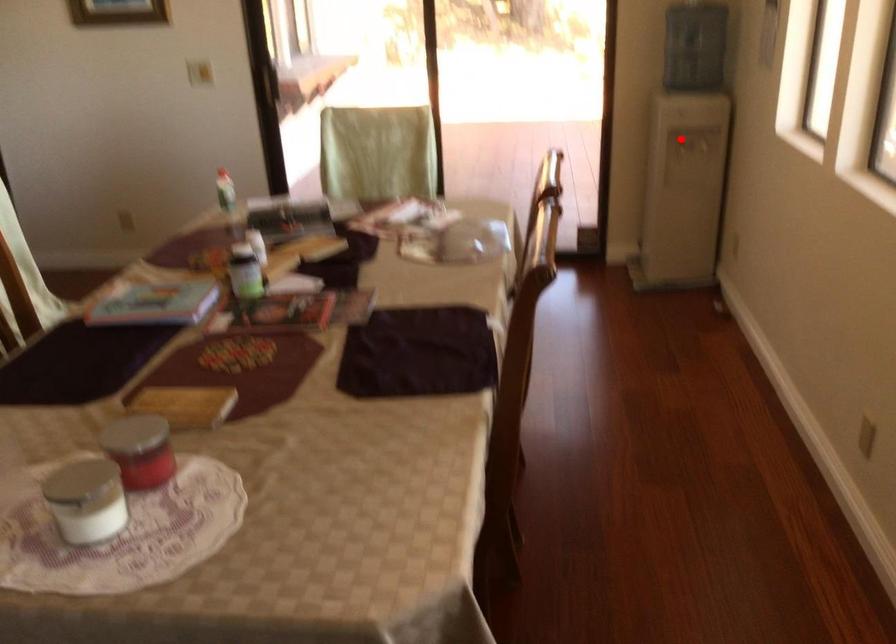
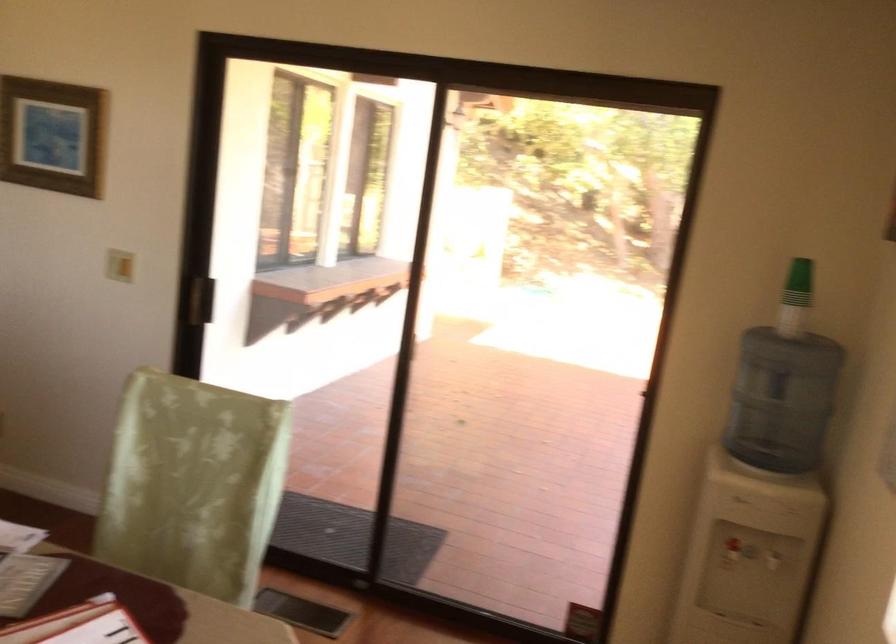
The point at the highlighted location is marked in the first image. Where is the corresponding point in the second image?

(731, 553)